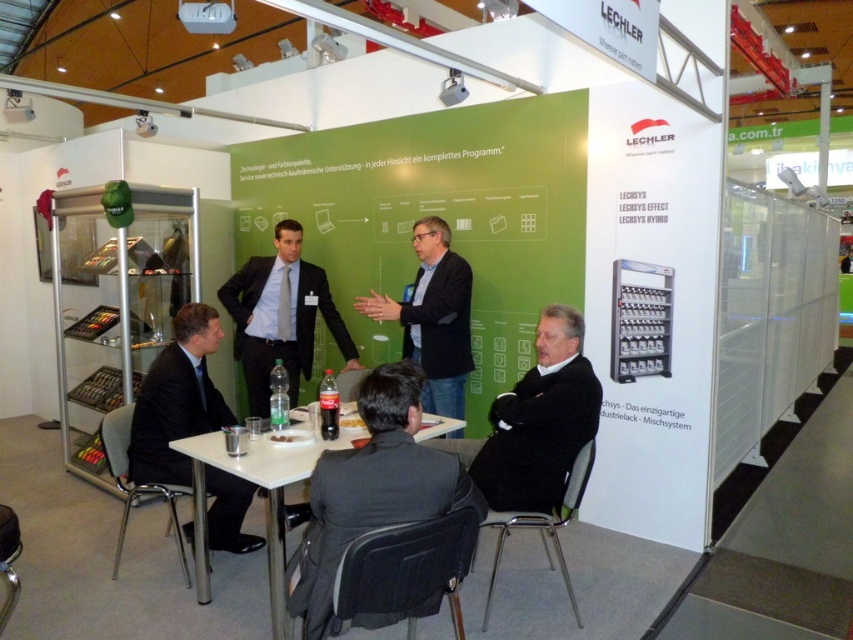
Is dark gray fabric business suit at center behind black fabric jacket at center?

No, it is not.

Is point (287, 564) closer to camera compared to point (428, 336)?

Yes, it is in front of point (428, 336).

Describe the element at coordinates (367, 513) in the screenshot. Image resolution: width=853 pixels, height=640 pixels. I see `dark gray fabric business suit at center` at that location.

Identify the location of dark gray fabric business suit at center. This screenshot has width=853, height=640. (367, 513).

Is dark gray fabric business suit at center to the right of black matte suit at lower left from the viewer's perspective?

Yes, dark gray fabric business suit at center is to the right of black matte suit at lower left.

Between dark gray fabric business suit at center and black matte suit at lower left, which one is positioned higher?

black matte suit at lower left is above.

Image resolution: width=853 pixels, height=640 pixels. In order to click on dark gray fabric business suit at center in this screenshot , I will do click(367, 513).

Does black matte suit at lower right appear on the right side of white plastic table at center?

Correct, you'll find black matte suit at lower right to the right of white plastic table at center.

Consider the image. Who is more distant from viewer, (556, 493) or (270, 456)?

The point (556, 493) is more distant.

Locate an element on the screen. black matte suit at lower right is located at coordinates coord(537,436).